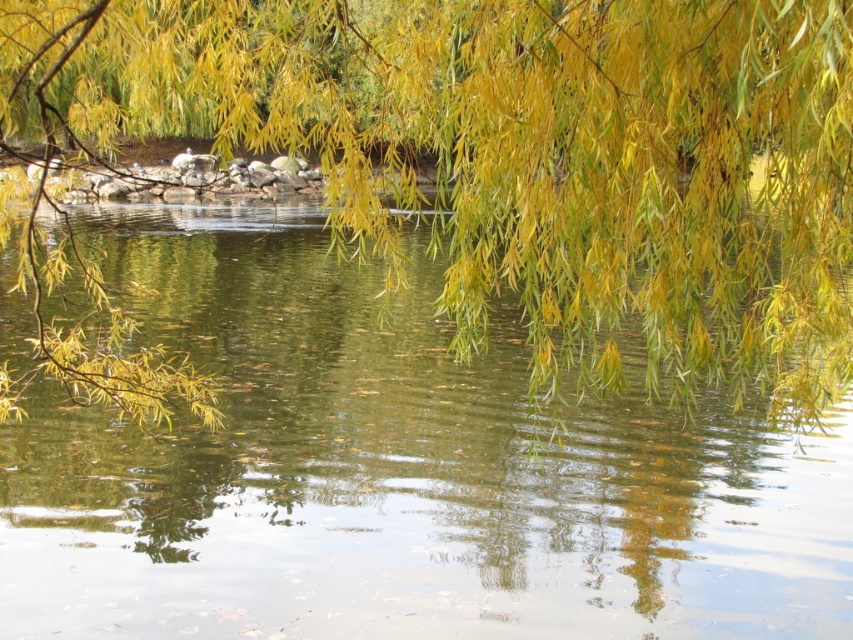
Which is more to the left, green reflective water at center or yellow-green leafy branches at upper center?

green reflective water at center is more to the left.

Between green reflective water at center and yellow-green leafy branches at upper center, which one is positioned higher?

green reflective water at center

Find the location of `green reflective water at center`. green reflective water at center is located at coordinates tap(393, 476).

Where is `green reflective water at center`? Image resolution: width=853 pixels, height=640 pixels. green reflective water at center is located at coordinates (393, 476).